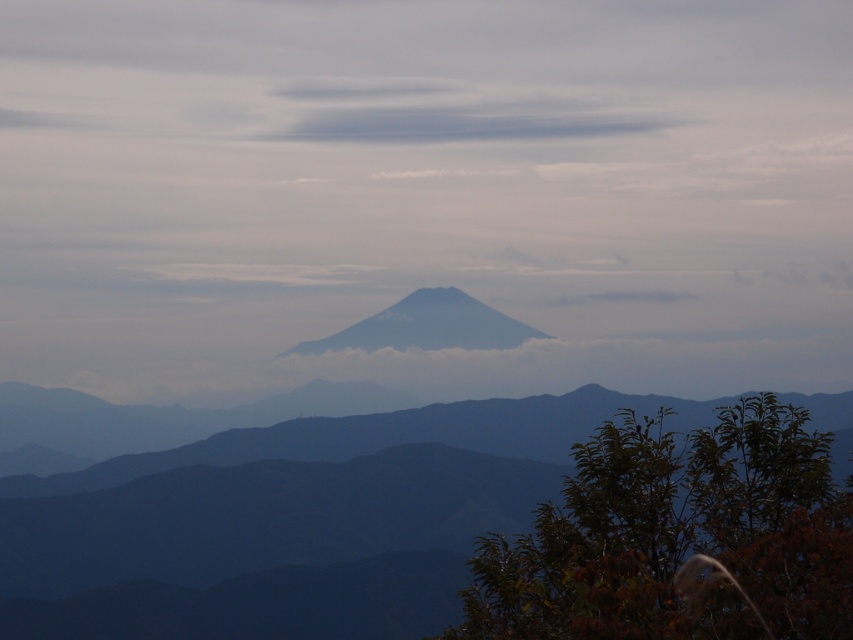
Question: Can you confirm if dark blue mountain range at center is smaller than gray/cloudy sky at upper center?

Choices:
 (A) no
 (B) yes

Answer: (A)

Question: Which point is farther to the camera?

Choices:
 (A) (332, 99)
 (B) (427, 348)

Answer: (A)

Question: Can you confirm if gray/cloudy sky at upper center is positioned to the right of grayish-blue rock formation at center?

Choices:
 (A) no
 (B) yes

Answer: (B)

Question: Among these points, which one is farthest from the camera?

Choices:
 (A) (225, 586)
 (B) (412, 337)
 (C) (338, 129)

Answer: (C)

Question: Which point is farther to the camera?

Choices:
 (A) (521, 625)
 (B) (329, 109)

Answer: (B)

Question: Does dark blue mountain range at center have a lesser width compared to gray/cloudy sky at upper center?

Choices:
 (A) no
 (B) yes

Answer: (A)